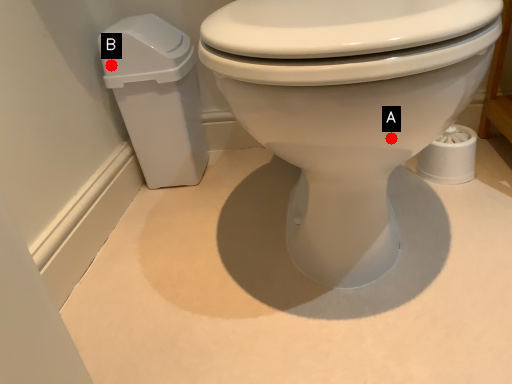
Question: Two points are circled on the image, labeled by A and B beside each circle. Which point is farther from the camera taking this photo?

Choices:
 (A) A is further
 (B) B is further

Answer: (B)